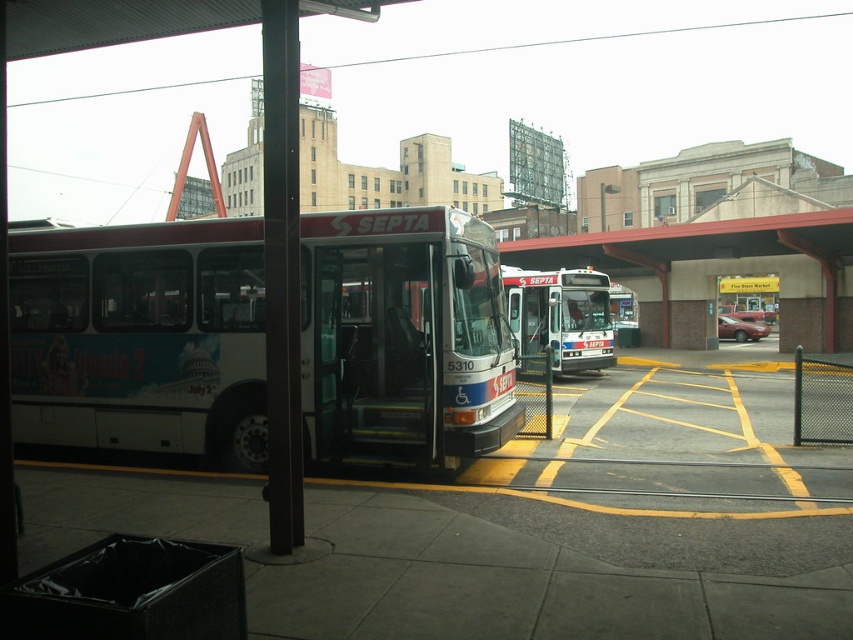
You are standing at the bus stop and see the white matte bus at center. Based on its 2D location coordinates, can you determine if it is positioned closer to the left or right side of the scene?

The white matte bus at center is located at coordinates point (x=141, y=339), which places it closer to the right side of the scene.